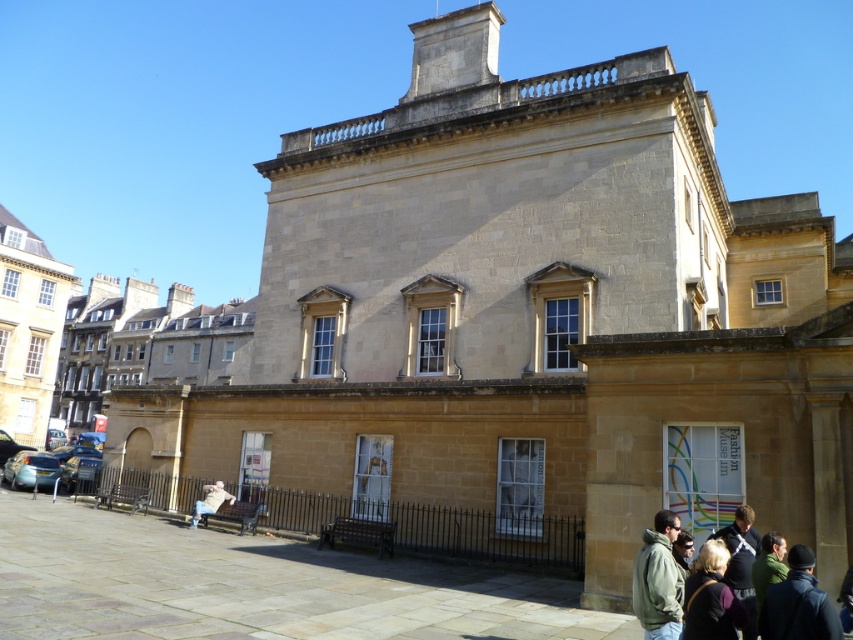
Question: Does dark blue shirt at lower right appear on the right side of dark green jacket at lower right?

Choices:
 (A) yes
 (B) no

Answer: (A)

Question: Is dark brown leather jacket at lower right further to the viewer compared to dark blue shirt at lower right?

Choices:
 (A) no
 (B) yes

Answer: (A)

Question: Is dark blue shirt at lower right above light brown fabric bench at lower left?

Choices:
 (A) yes
 (B) no

Answer: (A)

Question: Which of the following is the closest to the observer?

Choices:
 (A) dark blue shirt at lower right
 (B) green fabric jacket at lower right
 (C) light brown fabric bench at lower left
 (D) green fleece jacket at lower right

Answer: (B)

Question: Among these points, which one is farthest from the camera?

Choices:
 (A) (798, 616)
 (B) (677, 536)
 (C) (751, 520)
 (D) (663, 561)

Answer: (C)

Question: Among these objects, which one is nearest to the camera?

Choices:
 (A) dark brown leather jacket at lower right
 (B) dark blue shirt at lower right
 (C) green fabric jacket at lower right
 (D) dark green jacket at lower right

Answer: (C)